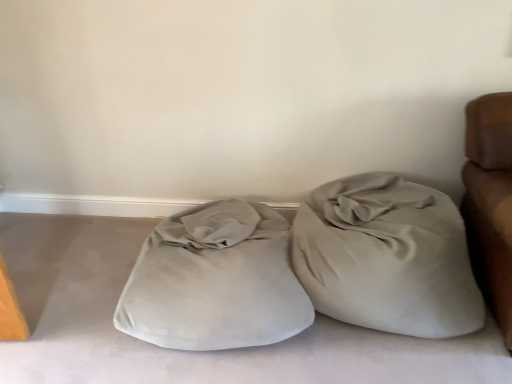
In order to click on suede-like beige pillow at center in this screenshot , I will do `click(215, 281)`.

What do you see at coordinates (215, 281) in the screenshot? I see `suede-like beige pillow at center` at bounding box center [215, 281].

Based on the photo, in order to face suede beige bean bag at right, should I rotate leftwards or rightwards?

Rotate your view right by about 16.061°.

Where is `suede beige bean bag at right`? suede beige bean bag at right is located at coordinates (387, 257).

This screenshot has width=512, height=384. Describe the element at coordinates (387, 257) in the screenshot. I see `suede beige bean bag at right` at that location.

Locate an element on the screen. The height and width of the screenshot is (384, 512). suede-like beige pillow at center is located at coordinates tap(215, 281).

Based on their positions, is suede beige bean bag at right located to the left or right of suede-like beige pillow at center?

In the image, suede beige bean bag at right appears on the right side of suede-like beige pillow at center.

Based on the photo, which is behind, suede beige bean bag at right or suede-like beige pillow at center?

suede beige bean bag at right is more distant.

Which is behind, point (346, 289) or point (289, 319)?

The point (346, 289) is farther.

From the image's perspective, which one is positioned lower, suede beige bean bag at right or suede-like beige pillow at center?

suede-like beige pillow at center is shown below in the image.

From a real-world perspective, between suede beige bean bag at right and suede-like beige pillow at center, who is vertically higher?

From a 3D spatial view, suede beige bean bag at right is above.

Considering the relative sizes of suede beige bean bag at right and suede-like beige pillow at center in the image provided, is suede beige bean bag at right wider than suede-like beige pillow at center?

No, suede beige bean bag at right is not wider than suede-like beige pillow at center.

In the scene shown: Does suede beige bean bag at right have a lesser height compared to suede-like beige pillow at center?

Incorrect, the height of suede beige bean bag at right does not fall short of that of suede-like beige pillow at center.

Is suede beige bean bag at right bigger or smaller than suede-like beige pillow at center?

Clearly, suede beige bean bag at right is smaller in size than suede-like beige pillow at center.

Is suede beige bean bag at right not within suede-like beige pillow at center?

That's correct, suede beige bean bag at right is outside of suede-like beige pillow at center.

Does suede beige bean bag at right touch suede-like beige pillow at center?

suede beige bean bag at right is not next to suede-like beige pillow at center, and they're not touching.

Could you tell me if suede beige bean bag at right is facing suede-like beige pillow at center?

No, suede beige bean bag at right is not facing towards suede-like beige pillow at center.

What's the angular difference between suede beige bean bag at right and suede-like beige pillow at center's facing directions?

3.35e-05 degrees separate the facing orientations of suede beige bean bag at right and suede-like beige pillow at center.

This screenshot has width=512, height=384. In order to click on throw pillow behind the suede-like beige pillow at center in this screenshot , I will do (387, 257).

Which object is positioned more to the left, suede-like beige pillow at center or suede beige bean bag at right?

Positioned to the left is suede-like beige pillow at center.

Which object is closer to the camera, suede-like beige pillow at center or suede beige bean bag at right?

suede-like beige pillow at center is in front.

Which point is more forward, (223, 232) or (459, 299)?

The point (459, 299) is in front.

From the image's perspective, which one is positioned lower, suede-like beige pillow at center or suede beige bean bag at right?

suede-like beige pillow at center, from the image's perspective.

From a real-world perspective, between suede-like beige pillow at center and suede beige bean bag at right, who is vertically higher?

suede beige bean bag at right.

Between suede-like beige pillow at center and suede beige bean bag at right, which one has smaller width?

suede beige bean bag at right is thinner.

Considering the sizes of objects suede-like beige pillow at center and suede beige bean bag at right in the image provided, who is shorter, suede-like beige pillow at center or suede beige bean bag at right?

suede-like beige pillow at center.

Is suede-like beige pillow at center bigger than suede beige bean bag at right?

Yes.

Would you say suede beige bean bag at right is part of suede-like beige pillow at center's contents?

That's incorrect, suede beige bean bag at right is not inside suede-like beige pillow at center.

Are suede-like beige pillow at center and suede beige bean bag at right far apart?

Actually, suede-like beige pillow at center and suede beige bean bag at right are a little close together.

Is suede-like beige pillow at center facing away from suede beige bean bag at right?

suede-like beige pillow at center does not have its back to suede beige bean bag at right.

Measure the distance from suede-like beige pillow at center to suede beige bean bag at right.

The distance of suede-like beige pillow at center from suede beige bean bag at right is 16.58 inches.

Find the location of a particular element. pillow in front of the suede beige bean bag at right is located at coordinates (215, 281).

Locate an element on the screen. Image resolution: width=512 pixels, height=384 pixels. throw pillow on the right of suede-like beige pillow at center is located at coordinates (387, 257).

Where is `pillow in front of the suede beige bean bag at right`? The image size is (512, 384). pillow in front of the suede beige bean bag at right is located at coordinates (215, 281).